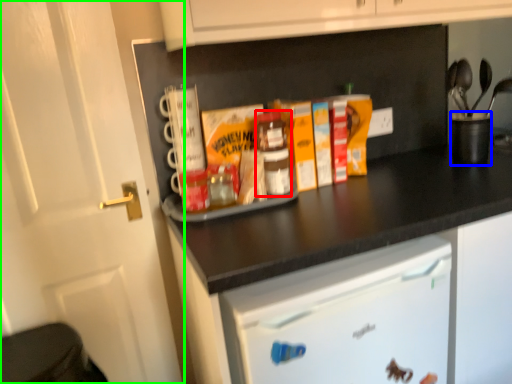
Question: Estimate the real-world distances between objects in this image. Which object is closer to bottle (highlighted by a red box), appliance (highlighted by a blue box) or door (highlighted by a green box)?

Choices:
 (A) appliance
 (B) door

Answer: (B)